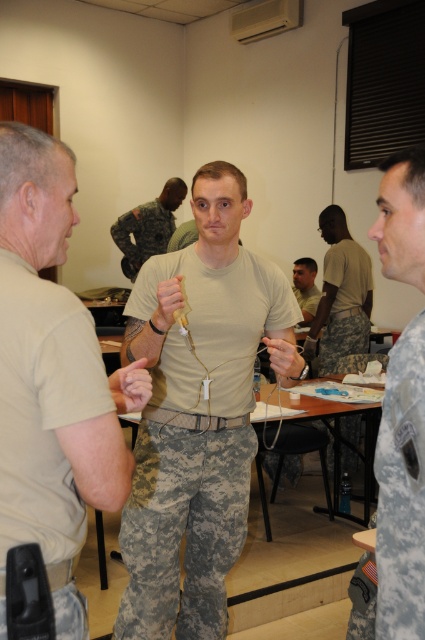
Between point (152, 266) and point (320, 340), which one is positioned in front?

Point (152, 266) is more forward.

What are the coordinates of `tan matte uniform at center` in the screenshot? It's located at (198, 413).

Between camouflage fabric uniform at center and matte khaki shirt at center, which one appears on the left side from the viewer's perspective?

camouflage fabric uniform at center is more to the left.

Locate an element on the screen. This screenshot has width=425, height=640. camouflage fabric uniform at center is located at coordinates (402, 490).

Between tan fabric shirt at center and matte khaki shirt at center, which one appears on the right side from the viewer's perspective?

matte khaki shirt at center is more to the right.

Is point (82, 532) farther from viewer compared to point (303, 296)?

No, (82, 532) is closer to viewer.

This screenshot has height=640, width=425. Identify the location of tan fabric shirt at center. (53, 378).